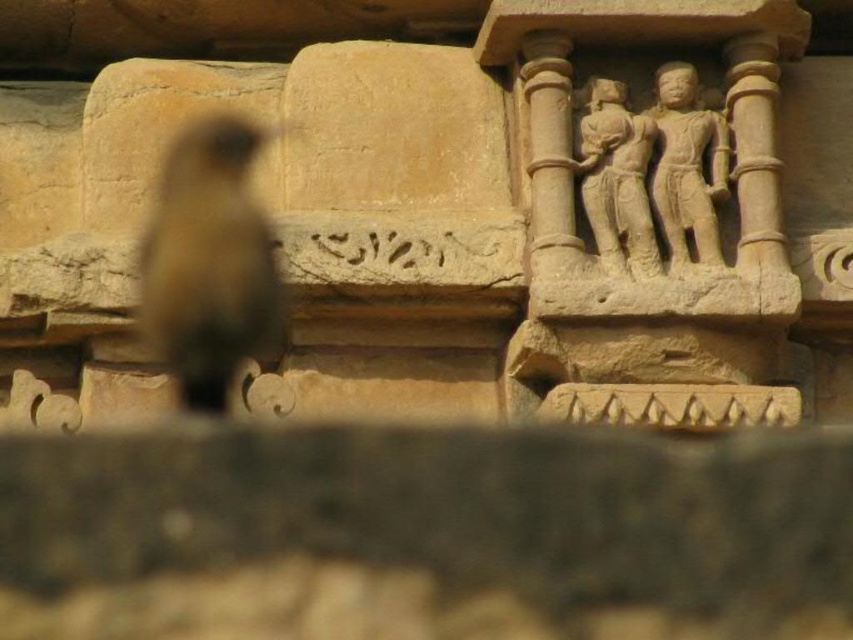
Between beige stone statue at upper right and carved stone figures at upper right, which one has more height?

beige stone statue at upper right

Can you confirm if beige stone statue at upper right is positioned above carved stone figures at upper right?

Actually, beige stone statue at upper right is below carved stone figures at upper right.

Locate an element on the screen. beige stone statue at upper right is located at coordinates [x=688, y=164].

Does point (732, 19) lie in front of point (567, 246)?

No, (732, 19) is behind (567, 246).

Find the location of `beige stone carving at upper right`. beige stone carving at upper right is located at coordinates (572, 161).

The image size is (853, 640). I want to click on beige stone carving at upper right, so click(x=572, y=161).

Can you confirm if beige stone statue at upper right is bigger than beige stone pillar at upper right?

No.

Does beige stone statue at upper right have a lesser height compared to beige stone pillar at upper right?

Yes.

Find the location of `beige stone statue at upper right`. beige stone statue at upper right is located at coordinates (688, 164).

Find the location of `beige stone statue at upper right`. beige stone statue at upper right is located at coordinates (688, 164).